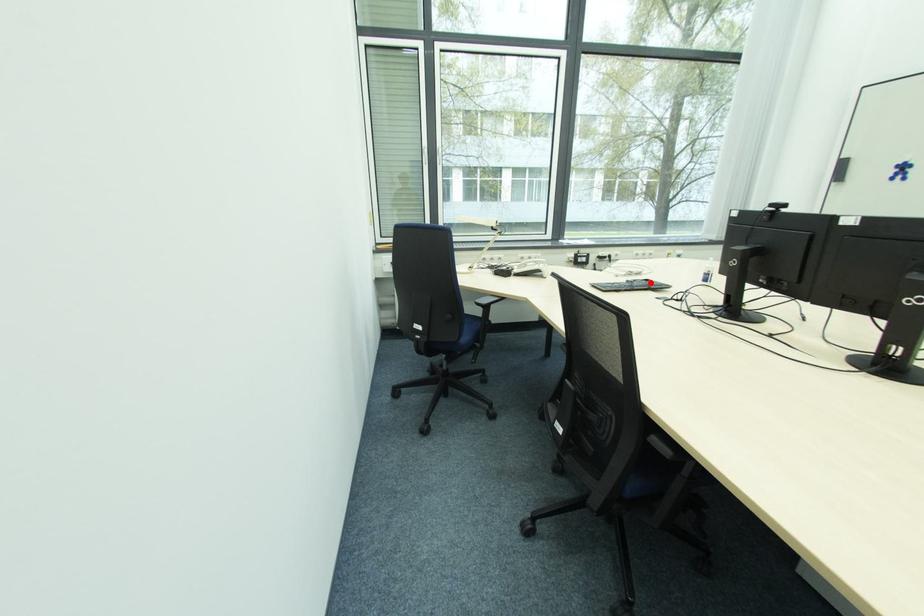
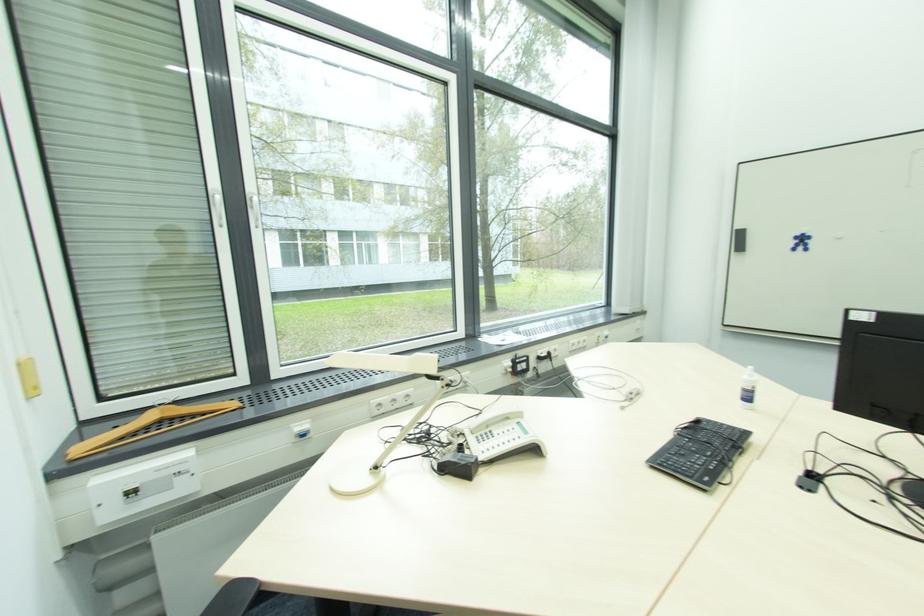
Find the pixel in the second image that matches the highlighted location in the first image.

(700, 424)